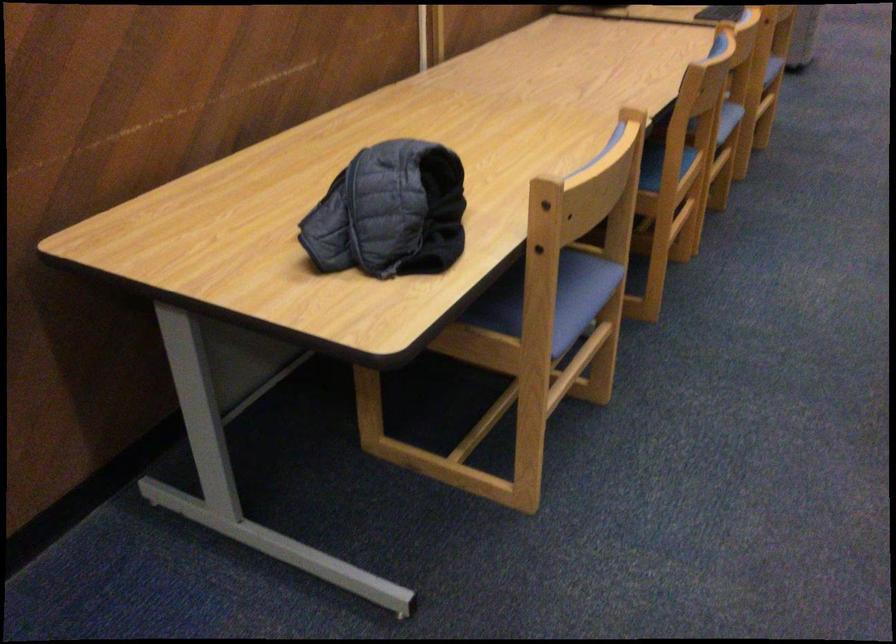
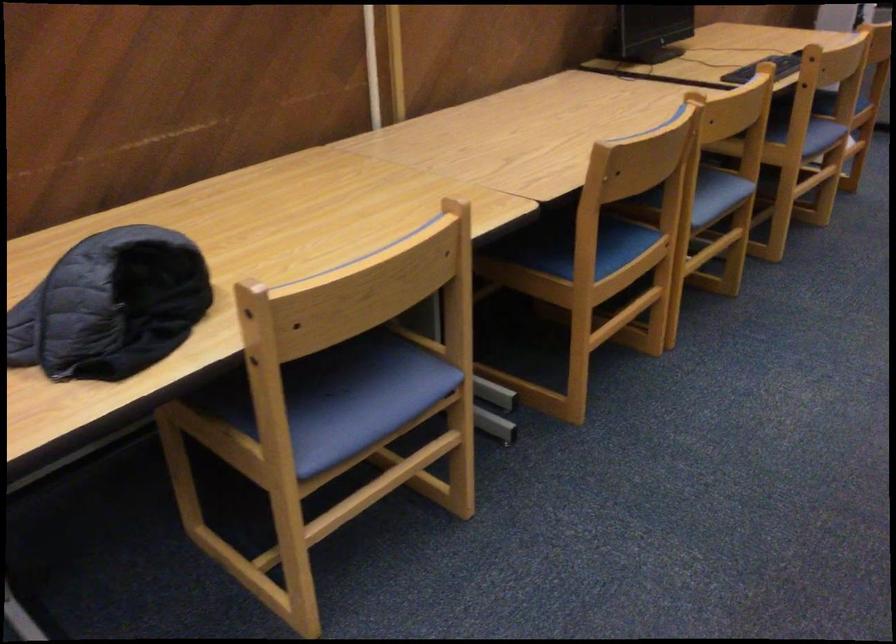
Question: How did the camera likely rotate?

Choices:
 (A) Left
 (B) Right
 (C) Up
 (D) Down

Answer: (A)